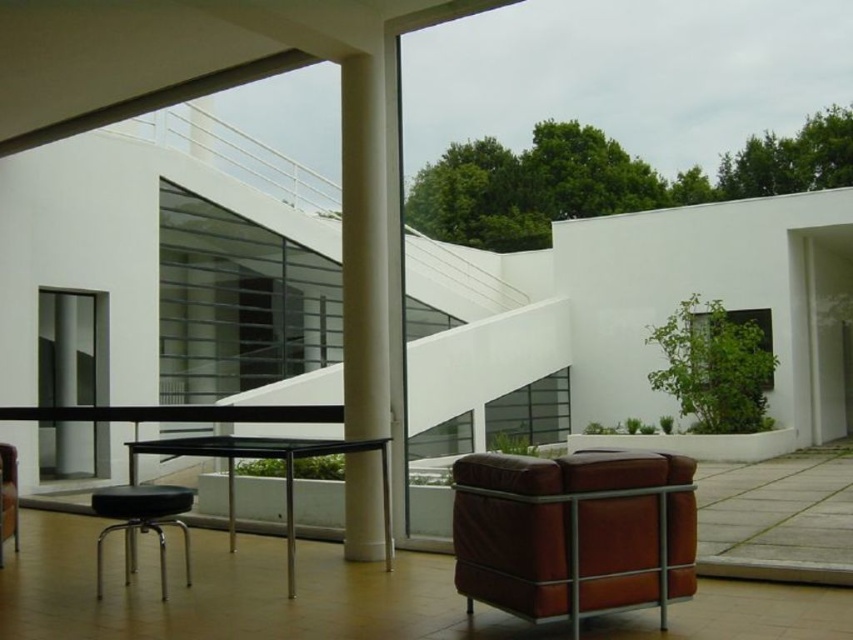
Question: Does brown leather armchair at lower right lie behind black glass table at center?

Choices:
 (A) no
 (B) yes

Answer: (A)

Question: Which point is closer to the camera?

Choices:
 (A) white smooth column at center
 (B) brown leather armchair at lower right

Answer: (B)

Question: Which object is the farthest from the black leather stool at lower left?

Choices:
 (A) brown leather armchair at lower right
 (B) black glass table at center
 (C) white smooth column at center

Answer: (A)

Question: Is brown leather armchair at lower right to the right of black glass table at center from the viewer's perspective?

Choices:
 (A) yes
 (B) no

Answer: (A)

Question: Where is brown leather armchair at lower right located in relation to black leather stool at lower left in the image?

Choices:
 (A) below
 (B) above

Answer: (B)

Question: Which point is closer to the camera?

Choices:
 (A) black leather stool at lower left
 (B) brown leather armchair at lower right
 (C) white smooth column at center

Answer: (B)